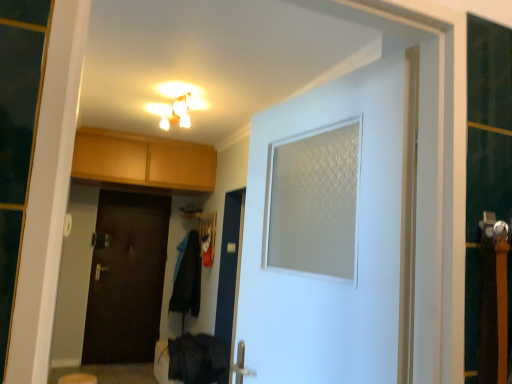
Image resolution: width=512 pixels, height=384 pixels. Identify the location of light brown wood cabinets at upper left. (143, 161).

Describe the element at coordinates (326, 232) in the screenshot. I see `white frosted glass door at center, which appears as the 2th door when viewed from the back` at that location.

Find the location of a particular element. The image size is (512, 384). matte white light fixture at upper center is located at coordinates (176, 111).

Locate an element on the screen. The height and width of the screenshot is (384, 512). black fabric coat at center, the 1th laundry positioned from the back is located at coordinates (187, 277).

Which point is more distant from viewer, (77, 161) or (179, 116)?

Point (77, 161)

Is the position of light brown wood cabinets at upper left less distant than that of matte white light fixture at upper center?

No, light brown wood cabinets at upper left is behind matte white light fixture at upper center.

From the image's perspective, which is above, light brown wood cabinets at upper left or matte white light fixture at upper center?

matte white light fixture at upper center, from the image's perspective.

Where is `cabinetry behind the matte white light fixture at upper center`? The width and height of the screenshot is (512, 384). cabinetry behind the matte white light fixture at upper center is located at coordinates (143, 161).

Is there a large distance between light brown wood cabinets at upper left and beige fabric step stool at lower left?

Yes, light brown wood cabinets at upper left is far from beige fabric step stool at lower left.

Can you tell me how much light brown wood cabinets at upper left and beige fabric step stool at lower left differ in facing direction?

There is a 89.7-degree angle between the facing directions of light brown wood cabinets at upper left and beige fabric step stool at lower left.

Is light brown wood cabinets at upper left bigger than beige fabric step stool at lower left?

Correct, light brown wood cabinets at upper left is larger in size than beige fabric step stool at lower left.

Is light brown wood cabinets at upper left positioned with its back to beige fabric step stool at lower left?

No, light brown wood cabinets at upper left is not facing the opposite direction of beige fabric step stool at lower left.

Find the location of a particular element. step stool that appears below the white frosted glass door at center, the 1th door when ordered from front to back (from a real-world perspective) is located at coordinates (78, 378).

Is beige fabric step stool at lower left aimed at white frosted glass door at center, which is the first door in right-to-left order?

No, beige fabric step stool at lower left is not oriented towards white frosted glass door at center, which is the first door in right-to-left order.

Based on the photo, between beige fabric step stool at lower left and white frosted glass door at center, which is the first door in right-to-left order, which one has larger width?

beige fabric step stool at lower left.

Is point (80, 381) more distant than point (393, 87)?

Yes, point (80, 381) is farther from viewer.

From the image's perspective, which is above, matte white light fixture at upper center or black fabric coat at center, which is the 1th laundry in top-to-bottom order?

matte white light fixture at upper center, from the image's perspective.

Are matte white light fixture at upper center and black fabric coat at center, the 2th laundry positioned from the front, making contact?

No, matte white light fixture at upper center is not making contact with black fabric coat at center, the 2th laundry positioned from the front.

Is matte white light fixture at upper center smaller than black fabric coat at center, which is the second laundry from bottom to top?

Indeed, matte white light fixture at upper center has a smaller size compared to black fabric coat at center, which is the second laundry from bottom to top.

Can you see dark wood door at center, acting as the first door starting from the left, touching white frosted glass door at center, which is the 2th door from left to right?

No, dark wood door at center, acting as the first door starting from the left, is not making contact with white frosted glass door at center, which is the 2th door from left to right.

From the image's perspective, is dark wood door at center, arranged as the second door when viewed from the front, located above or below white frosted glass door at center, which is the 2th door from left to right?

dark wood door at center, arranged as the second door when viewed from the front, is below white frosted glass door at center, which is the 2th door from left to right.

Considering the sizes of objects dark wood door at center, arranged as the second door when viewed from the front, and white frosted glass door at center, which is the first door in right-to-left order, in the image provided, who is shorter, dark wood door at center, arranged as the second door when viewed from the front, or white frosted glass door at center, which is the first door in right-to-left order,?

white frosted glass door at center, which is the first door in right-to-left order, is shorter.

The height and width of the screenshot is (384, 512). Find the location of `door behind the white frosted glass door at center, the 1th door when ordered from front to back`. door behind the white frosted glass door at center, the 1th door when ordered from front to back is located at coordinates (126, 278).

Measure the distance from light brown wood cabinets at upper left to white frosted glass door at center, which appears as the 2th door when viewed from the back.

light brown wood cabinets at upper left and white frosted glass door at center, which appears as the 2th door when viewed from the back, are 11.11 feet apart from each other.

Is white frosted glass door at center, which appears as the 2th door when viewed from the back, at the back of light brown wood cabinets at upper left?

No, light brown wood cabinets at upper left is not facing away from white frosted glass door at center, which appears as the 2th door when viewed from the back.

From a real-world perspective, which is physically above, light brown wood cabinets at upper left or white frosted glass door at center, which appears as the 2th door when viewed from the back?

In real-world perspective, light brown wood cabinets at upper left is above.

Between light brown wood cabinets at upper left and white frosted glass door at center, the 1th door when ordered from front to back, which one appears on the left side from the viewer's perspective?

light brown wood cabinets at upper left.

Is beige fabric step stool at lower left bigger than dark fabric laundry at lower center, the 2th laundry from the top?

No.

Does beige fabric step stool at lower left have a greater width compared to dark fabric laundry at lower center, the second laundry when ordered from back to front?

Incorrect, the width of beige fabric step stool at lower left does not surpass that of dark fabric laundry at lower center, the second laundry when ordered from back to front.

Would you say beige fabric step stool at lower left is a long distance from dark fabric laundry at lower center, which is counted as the 1th laundry, starting from the front?

Absolutely, beige fabric step stool at lower left is distant from dark fabric laundry at lower center, which is counted as the 1th laundry, starting from the front.

In order to click on cabinetry behind the matte white light fixture at upper center in this screenshot , I will do `click(143, 161)`.

I want to click on cabinetry above the beige fabric step stool at lower left (from the image's perspective), so click(x=143, y=161).

When comparing their distances from white frosted glass door at center, which is the 2th door from left to right, does dark wood door at center, which appears as the second door when viewed from the right, or dark fabric laundry at lower center, the 2th laundry from the top, seem further?

The object further to white frosted glass door at center, which is the 2th door from left to right, is dark wood door at center, which appears as the second door when viewed from the right.

When comparing their distances from dark wood door at center, which appears as the second door when viewed from the right, does beige fabric step stool at lower left or matte white light fixture at upper center seem further?

matte white light fixture at upper center.

Based on their spatial positions, is dark fabric laundry at lower center, the second laundry when ordered from back to front, or light brown wood cabinets at upper left further from beige fabric step stool at lower left?

light brown wood cabinets at upper left is positioned further to the anchor beige fabric step stool at lower left.

Considering their positions, is black fabric coat at center, which is the second laundry from bottom to top, positioned further to light brown wood cabinets at upper left than beige fabric step stool at lower left?

beige fabric step stool at lower left is positioned further to the anchor light brown wood cabinets at upper left.

When comparing their distances from beige fabric step stool at lower left, does dark wood door at center, acting as the first door starting from the left, or matte white light fixture at upper center seem closer?

dark wood door at center, acting as the first door starting from the left, is positioned closer to the anchor beige fabric step stool at lower left.

Looking at the image, which one is located closer to white frosted glass door at center, which is the 2th door from left to right, dark fabric laundry at lower center, which is counted as the 1th laundry, starting from the bottom, or black fabric coat at center, the 1th laundry positioned from the back?

Based on the image, dark fabric laundry at lower center, which is counted as the 1th laundry, starting from the bottom, appears to be nearer to white frosted glass door at center, which is the 2th door from left to right.

Consider the image. Estimate the real-world distances between objects in this image. Which object is closer to black fabric coat at center, the 2th laundry positioned from the front, white frosted glass door at center, which is the 2th door from left to right, or dark wood door at center, which appears as the second door when viewed from the right?

The object closer to black fabric coat at center, the 2th laundry positioned from the front, is dark wood door at center, which appears as the second door when viewed from the right.

Which object lies further to the anchor point light brown wood cabinets at upper left, dark wood door at center, which appears as the second door when viewed from the right, or beige fabric step stool at lower left?

beige fabric step stool at lower left is further to light brown wood cabinets at upper left.

Locate an element on the screen. This screenshot has width=512, height=384. step stool positioned between white frosted glass door at center, which is the first door in right-to-left order, and dark wood door at center, positioned as the 1th door in back-to-front order, from near to far is located at coordinates (78, 378).

The image size is (512, 384). I want to click on cabinetry positioned between white frosted glass door at center, which is the 2th door from left to right, and black fabric coat at center, which is the 1th laundry in top-to-bottom order, from near to far, so click(143, 161).

Image resolution: width=512 pixels, height=384 pixels. Find the location of `door between dark fabric laundry at lower center, which is counted as the 1th laundry, starting from the bottom, and black fabric coat at center, the 2th laundry positioned from the front, from front to back`. door between dark fabric laundry at lower center, which is counted as the 1th laundry, starting from the bottom, and black fabric coat at center, the 2th laundry positioned from the front, from front to back is located at coordinates (126, 278).

Locate an element on the screen. This screenshot has height=384, width=512. step stool between white frosted glass door at center, which is the 2th door from left to right, and black fabric coat at center, which is the second laundry from bottom to top, in the front-back direction is located at coordinates click(x=78, y=378).